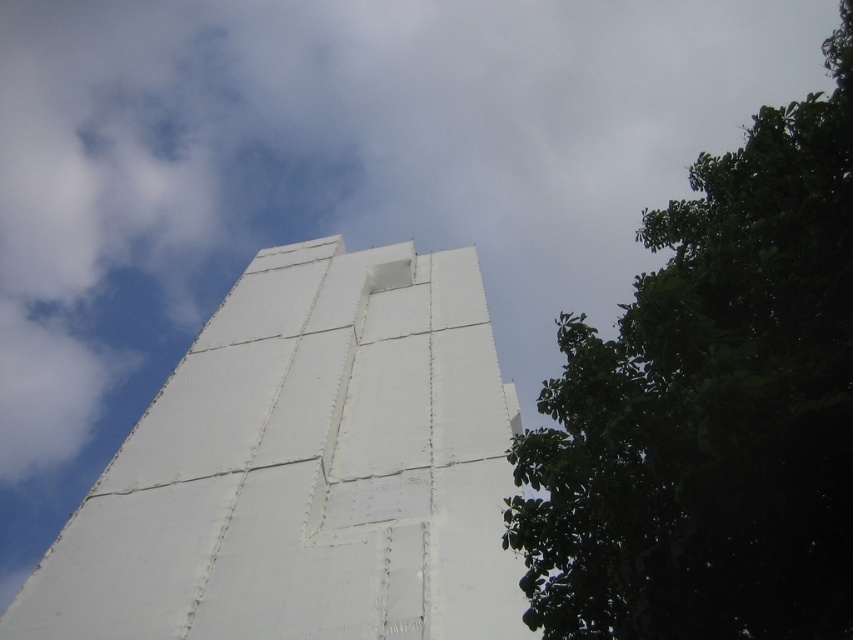
Who is lower down, white matte tower at center or green leafy tree at lower right?

white matte tower at center is below.

The width and height of the screenshot is (853, 640). What do you see at coordinates (306, 468) in the screenshot? I see `white matte tower at center` at bounding box center [306, 468].

Find the location of a particular element. This screenshot has height=640, width=853. white matte tower at center is located at coordinates (306, 468).